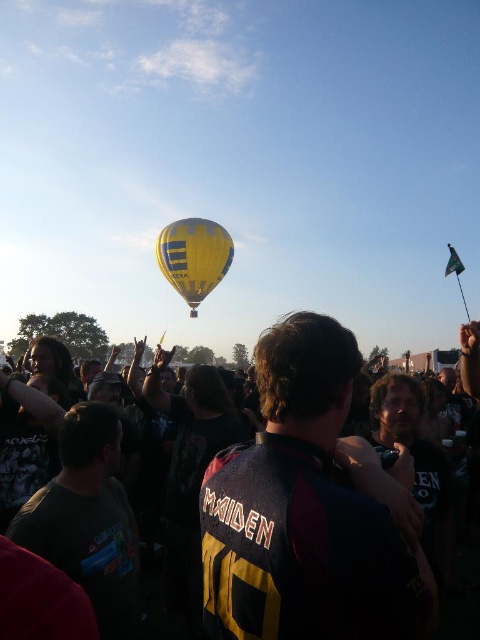
You are a photographer at the festival and want to capture both the dark gray jersey at center and the yellow fabric balloon at center in your shot. Which object should you frame first to ensure both are visible?

The dark gray jersey at center is positioned on the right side of yellow fabric balloon at center. To ensure both are visible, you should frame the yellow fabric balloon at center first since it is on the left, allowing space for the dark gray jersey at center to the right.